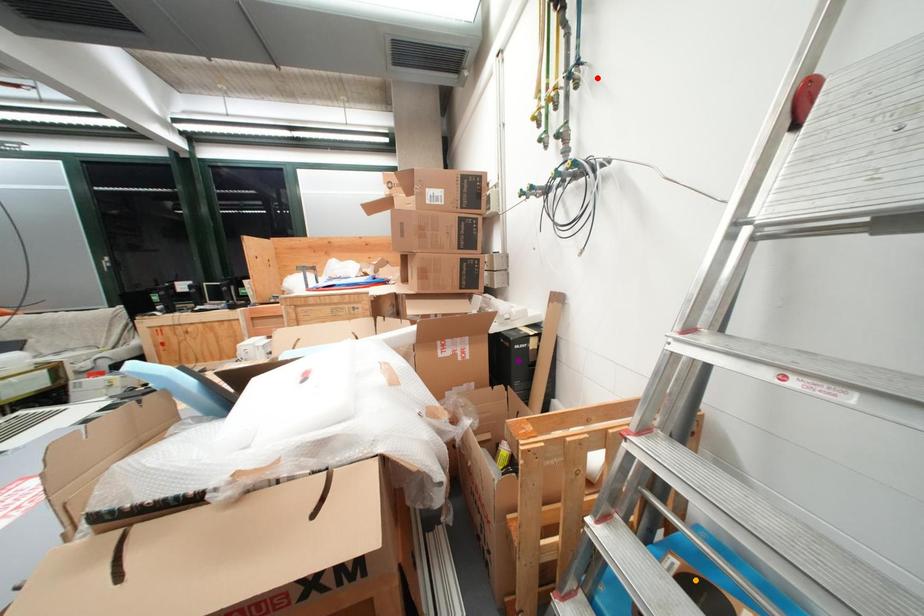
Order these from nearest to farthest:
orange point
purple point
red point

purple point → red point → orange point